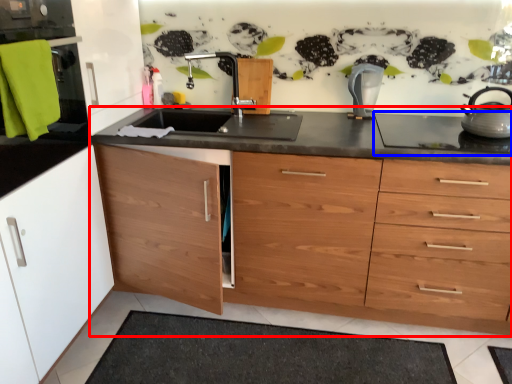
Question: Among these objects, which one is farthest to the camera, countertop (highlighted by a red box) or gas stove (highlighted by a blue box)?

Choices:
 (A) countertop
 (B) gas stove

Answer: (B)